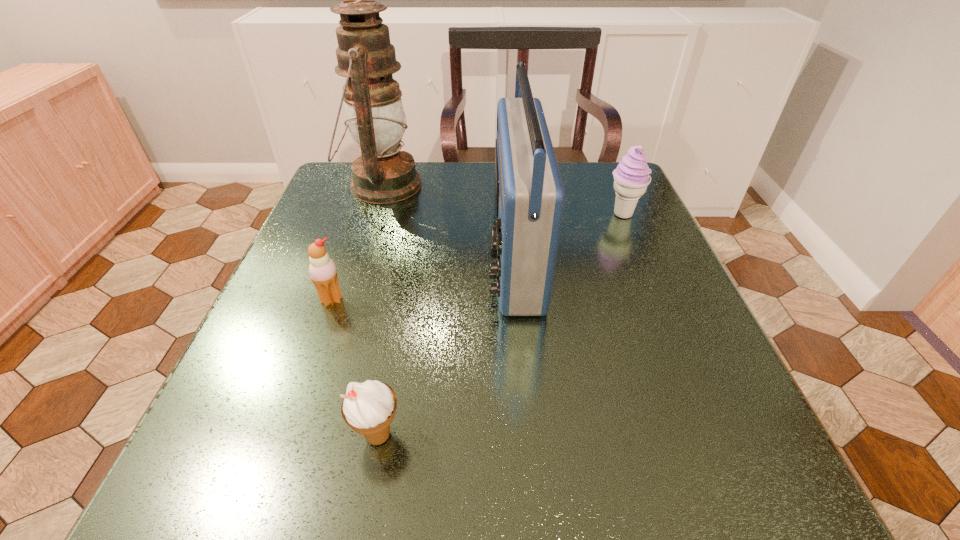
The width and height of the screenshot is (960, 540). Identify the location of free spot at the near right corner of the desktop. (723, 480).

In order to click on free space between the farthest icecream and the leftmost icecream in this screenshot , I will do `click(477, 257)`.

You are a GUI agent. You are given a task and a screenshot of the screen. Output one action in this format:
    pyautogui.click(x=<x>, y=<y>)
    Task: Click on the vacant area that lies between the rightmost object and the second object from right to left
    This screenshot has width=960, height=540.
    Given the screenshot: What is the action you would take?
    pyautogui.click(x=568, y=234)

Identify the location of free space between the second nearest icecream and the rightmost icecream. The image size is (960, 540). (477, 257).

The width and height of the screenshot is (960, 540). I want to click on unoccupied position between the second icecream from right to left and the second nearest icecream, so click(355, 368).

Image resolution: width=960 pixels, height=540 pixels. What are the coordinates of `vacant area that lies between the lantern and the nearest object` in the screenshot? It's located at (380, 310).

Find the location of a particular element. The height and width of the screenshot is (540, 960). free point between the leftmost icecream and the tallest object is located at coordinates pyautogui.click(x=357, y=243).

You are a GUI agent. You are given a task and a screenshot of the screen. Output one action in this format:
    pyautogui.click(x=<x>, y=<y>)
    Task: Click on the free spot between the lantern and the second object from right to left
    This screenshot has width=960, height=540.
    Given the screenshot: What is the action you would take?
    pyautogui.click(x=448, y=220)

The image size is (960, 540). Identify the location of the closest object relative to the farthest icecream. (529, 196).

You are a GUI agent. You are given a task and a screenshot of the screen. Output one action in this format:
    pyautogui.click(x=<x>, y=<y>)
    Task: Click on the object that is the fourth closest to the third tallest object
    The image size is (960, 540).
    Given the screenshot: What is the action you would take?
    pyautogui.click(x=368, y=408)